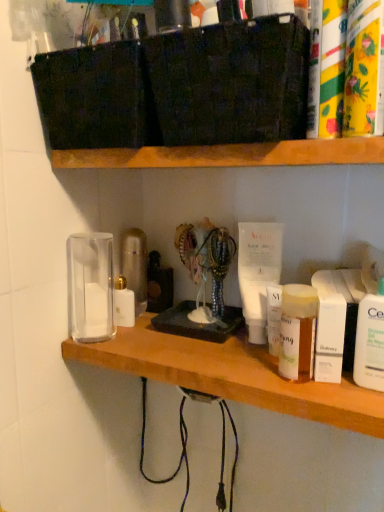
Where is `free region under wooden shelf at upper center, the second shelf ordered from the bottom (from a real-world perspective)`? The image size is (384, 512). free region under wooden shelf at upper center, the second shelf ordered from the bottom (from a real-world perspective) is located at coordinates (194, 344).